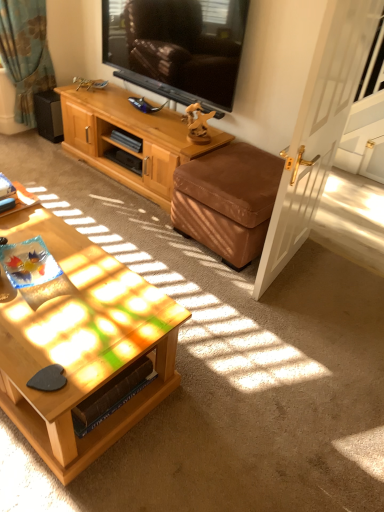
The width and height of the screenshot is (384, 512). I want to click on free spot to the left of white glossy door at right, so click(201, 272).